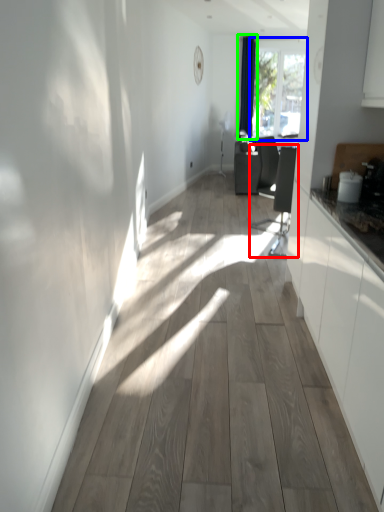
Question: Estimate the real-world distances between objects in this image. Which object is closer to swivel chair (highlighted by a red box), window (highlighted by a blue box) or curtain (highlighted by a green box)?

Choices:
 (A) window
 (B) curtain

Answer: (B)